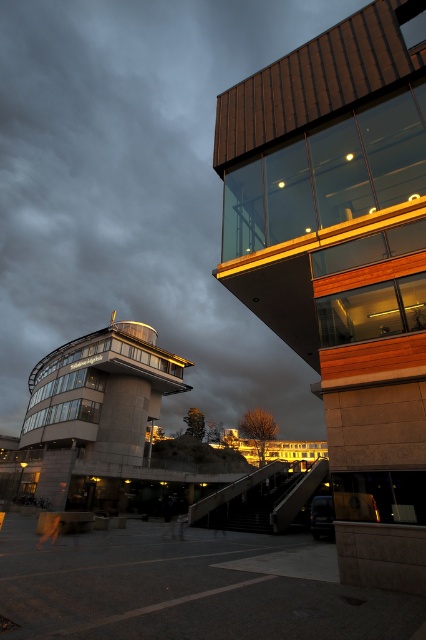
Could you measure the distance between dark brown wooden tower at upper right and matte glass control tower at center-left?

dark brown wooden tower at upper right is 27.99 meters away from matte glass control tower at center-left.

In order to click on dark brown wooden tower at upper right in this screenshot , I will do `click(336, 221)`.